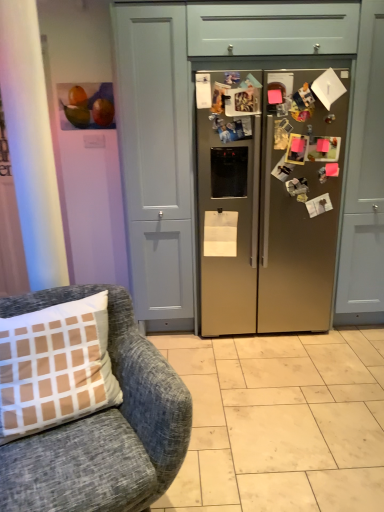
What do you see at coordinates (268, 198) in the screenshot? I see `satin gold refrigerator at center` at bounding box center [268, 198].

The height and width of the screenshot is (512, 384). I want to click on beige tile at lower center, so click(281, 422).

What is the approximate width of matte gray drawer at upper center?

It is 26.11 inches.

What is the approximate width of matte acrylic painting of fruits at upper left?

5.97 centimeters.

Measure the distance between point (107, 108) and camera.

Point (107, 108) and camera are 9.62 feet apart.

This screenshot has height=512, width=384. What do you see at coordinates (155, 159) in the screenshot?
I see `matte gray cabinet at left` at bounding box center [155, 159].

Locate an element on the screen. The height and width of the screenshot is (512, 384). satin metallic refrigerator at center is located at coordinates (364, 182).

Locate an element on the screen. This screenshot has width=384, height=512. satin gold refrigerator at center is located at coordinates (268, 198).

The width and height of the screenshot is (384, 512). In order to click on tile below the satin gold refrigerator at center (from the image's perspective) in this screenshot , I will do `click(281, 422)`.

Can you tell me how much satin gold refrigerator at center and beige tile at lower center differ in facing direction?

There is a 90.2-degree angle between the facing directions of satin gold refrigerator at center and beige tile at lower center.

Who is shorter, satin gold refrigerator at center or beige tile at lower center?

With less height is beige tile at lower center.

Which object is closer to the camera taking this photo, satin gold refrigerator at center or beige tile at lower center?

beige tile at lower center is more forward.

Is matte acrylic painting of fruits at upper left not near matte gray drawer at upper center?

Yes, matte acrylic painting of fruits at upper left and matte gray drawer at upper center are located far from each other.

Between matte acrylic painting of fruits at upper left and matte gray drawer at upper center, which one has smaller width?

Thinner between the two is matte acrylic painting of fruits at upper left.

Could you measure the distance between matte acrylic painting of fruits at upper left and matte gray drawer at upper center?

matte acrylic painting of fruits at upper left is 1.00 meters from matte gray drawer at upper center.

Considering the sizes of objects matte acrylic painting of fruits at upper left and matte gray drawer at upper center in the image provided, who is bigger, matte acrylic painting of fruits at upper left or matte gray drawer at upper center?

Bigger between the two is matte gray drawer at upper center.

In the scene shown: Considering the relative sizes of matte acrylic painting of fruits at upper left and textured gray fabric chair at lower left in the image provided, is matte acrylic painting of fruits at upper left smaller than textured gray fabric chair at lower left?

Yes.

Considering the relative sizes of matte acrylic painting of fruits at upper left and textured gray fabric chair at lower left in the image provided, is matte acrylic painting of fruits at upper left shorter than textured gray fabric chair at lower left?

Indeed, matte acrylic painting of fruits at upper left has a lesser height compared to textured gray fabric chair at lower left.

Could you tell me if matte acrylic painting of fruits at upper left is turned towards textured gray fabric chair at lower left?

No, matte acrylic painting of fruits at upper left is not facing towards textured gray fabric chair at lower left.

Which of these two, matte acrylic painting of fruits at upper left or textured gray fabric chair at lower left, is wider?

Wider between the two is textured gray fabric chair at lower left.

From the image's perspective, does satin gold refrigerator at center appear higher than matte gray cabinet at left?

Incorrect, from the image's perspective, satin gold refrigerator at center is lower than matte gray cabinet at left.

Who is shorter, satin gold refrigerator at center or matte gray cabinet at left?

With less height is satin gold refrigerator at center.

Is satin gold refrigerator at center touching matte gray cabinet at left?

No, satin gold refrigerator at center is not in contact with matte gray cabinet at left.

Between textured gray fabric chair at lower left and beige tile at lower center, which one has smaller size?

Smaller between the two is beige tile at lower center.

Is textured gray fabric chair at lower left turned away from beige tile at lower center?

No.

Would you say textured gray fabric chair at lower left is a long distance from beige tile at lower center?

No.

Considering the sizes of textured gray fabric chair at lower left and beige tile at lower center in the image, is textured gray fabric chair at lower left taller or shorter than beige tile at lower center?

In the image, textured gray fabric chair at lower left appears to be taller than beige tile at lower center.

Can you confirm if matte gray cabinet at left is smaller than textured gray fabric chair at lower left?

No.

In the scene shown: From a real-world perspective, relative to textured gray fabric chair at lower left, is matte gray cabinet at left vertically above or below?

In terms of real-world spatial position, matte gray cabinet at left is above textured gray fabric chair at lower left.

From the image's perspective, is matte gray cabinet at left above or below textured gray fabric chair at lower left?

Clearly, from the image's perspective, matte gray cabinet at left is above textured gray fabric chair at lower left.

From the image's perspective, who appears lower, matte gray cabinet at left or matte gray drawer at upper center?

matte gray cabinet at left.

Does matte gray cabinet at left have a greater width compared to matte gray drawer at upper center?

Yes, matte gray cabinet at left is wider than matte gray drawer at upper center.

From a real-world perspective, is matte gray cabinet at left physically located above or below matte gray drawer at upper center?

matte gray cabinet at left is below matte gray drawer at upper center.

Identify the location of tile below the satin gold refrigerator at center (from the image's perspective). (281, 422).

At what (x,y) coordinates should I click in order to perform the action: click on fruit behind the matte gray drawer at upper center. Please return your answer as a coordinate pair (x, y). Looking at the image, I should click on (86, 106).

Which object lies further to the anchor point satin metallic refrigerator at center, beige tile at lower center or textured gray fabric chair at lower left?

textured gray fabric chair at lower left is positioned further to the anchor satin metallic refrigerator at center.

Estimate the real-world distances between objects in this image. Which object is closer to matte gray cabinet at left, matte acrylic painting of fruits at upper left or matte gray drawer at upper center?

Based on the image, matte acrylic painting of fruits at upper left appears to be nearer to matte gray cabinet at left.

Considering their positions, is matte gray drawer at upper center positioned closer to textured gray fabric chair at lower left than satin gold refrigerator at center?

satin gold refrigerator at center lies closer to textured gray fabric chair at lower left than the other object.

From the image, which object appears to be farther from textured gray fabric chair at lower left, beige tile at lower center or matte gray drawer at upper center?

The object further to textured gray fabric chair at lower left is matte gray drawer at upper center.

From the image, which object appears to be nearer to textured gray fabric chair at lower left, matte gray drawer at upper center or matte acrylic painting of fruits at upper left?

The object closer to textured gray fabric chair at lower left is matte gray drawer at upper center.

Based on their spatial positions, is beige tile at lower center or satin gold refrigerator at center further from matte gray drawer at upper center?

beige tile at lower center is further to matte gray drawer at upper center.

Considering their positions, is satin metallic refrigerator at center positioned further to textured gray fabric chair at lower left than matte gray cabinet at left?

satin metallic refrigerator at center lies further to textured gray fabric chair at lower left than the other object.

Looking at this image, estimate the real-world distances between objects in this image. Which object is closer to matte gray drawer at upper center, satin metallic refrigerator at center or matte acrylic painting of fruits at upper left?

The object closer to matte gray drawer at upper center is satin metallic refrigerator at center.

What are the coordinates of `glass door between textured gray fabric chair at lower left and matte acrylic painting of fruits at upper left along the z-axis` in the screenshot? It's located at (155, 159).

Where is `fruit that lies between matte gray drawer at upper center and beige tile at lower center from top to bottom`? fruit that lies between matte gray drawer at upper center and beige tile at lower center from top to bottom is located at coordinates point(86,106).

Identify the location of glass door situated between matte acrylic painting of fruits at upper left and matte gray drawer at upper center from left to right. (155, 159).

Where is `drawer located between matte acrylic painting of fruits at upper left and satin gold refrigerator at center in the left-right direction`? The height and width of the screenshot is (512, 384). drawer located between matte acrylic painting of fruits at upper left and satin gold refrigerator at center in the left-right direction is located at coordinates (272, 29).